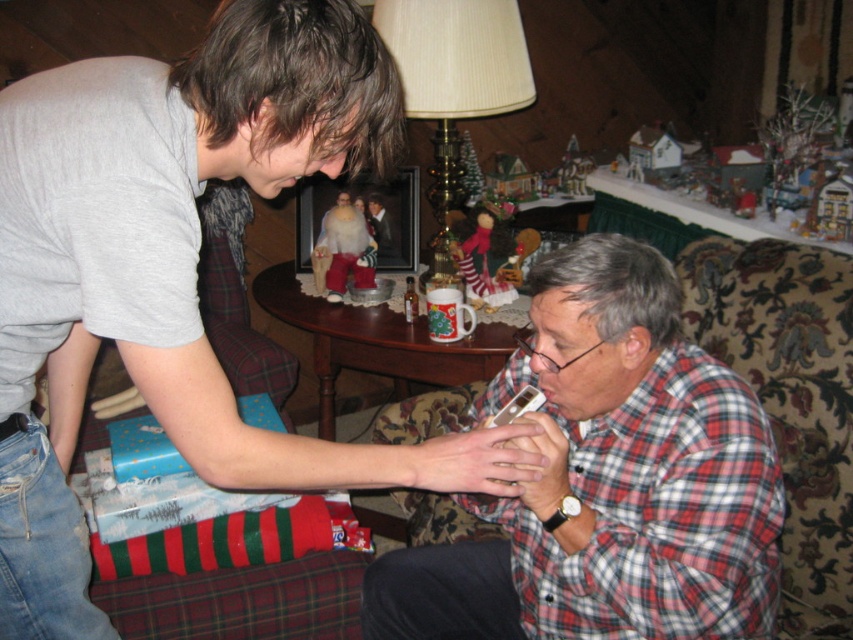
Describe the element at coordinates (173, 273) in the screenshot. I see `plaid flannel shirt at lower right` at that location.

Between plaid flannel shirt at lower right and plaid fabric shirt at lower right, which one is positioned lower?

plaid fabric shirt at lower right is lower down.

Is point (44, 518) behind point (628, 280)?

No, (44, 518) is closer to viewer.

The width and height of the screenshot is (853, 640). I want to click on plaid flannel shirt at lower right, so click(173, 273).